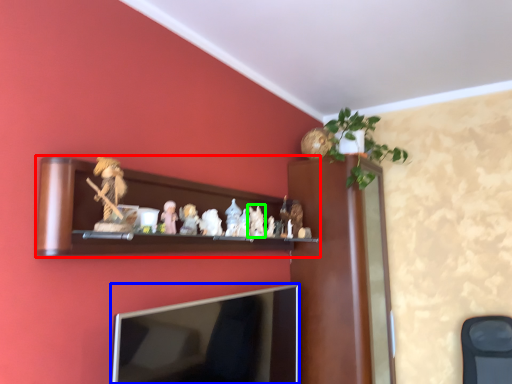
Question: Based on their relative distances, which object is nearer to shelf (highlighted by a red box)? Choose from television (highlighted by a blue box) and toy (highlighted by a green box).

Choices:
 (A) television
 (B) toy

Answer: (A)